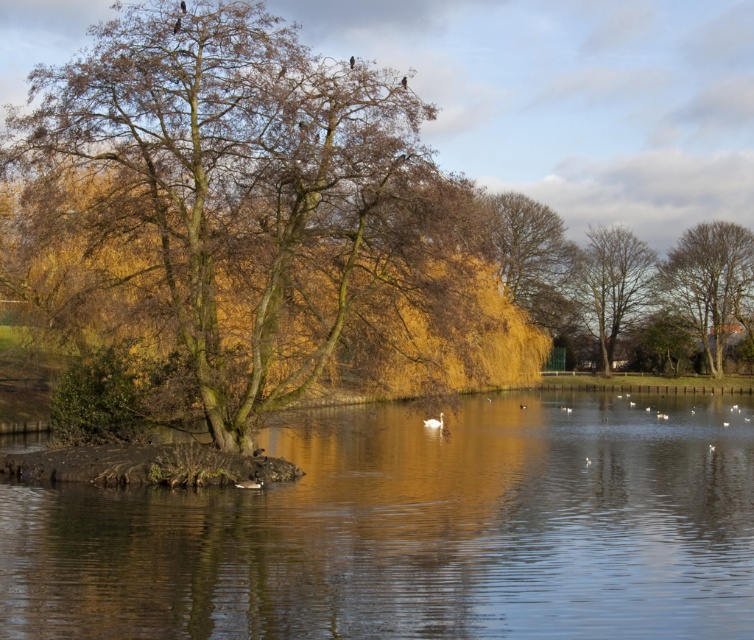
You are standing at the lakeside and see the bare branches tree at right and the white matte duck at center. Which object is positioned to the right side of the other?

The bare branches tree at right is to the right of the white matte duck at center.

You are a photographer trying to capture the white matte duck at center and the bare branches tree at right in the same frame. Which object will appear larger in your photo?

The bare branches tree at right will appear larger in the photo because it is taller than the white matte duck at center.

You are standing at the lakeside and want to take a photo of the brown leafy tree at right. If your camera can focus on objects up to 100 meters away, will it be able to capture the tree clearly?

The brown leafy tree at right is 98.34 meters away from the viewer, so yes, the camera can focus on it clearly since the distance is within the 100 meters range.